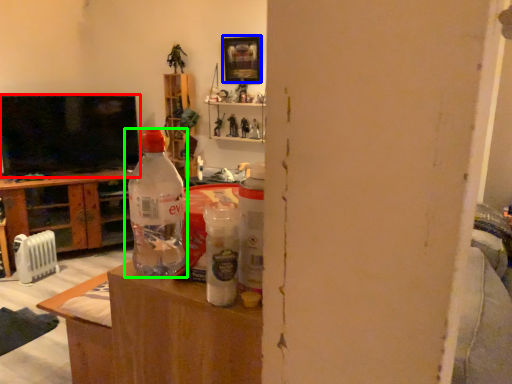
Question: Which is farther away from television (highlighted by a red box)? picture frame (highlighted by a blue box) or bottle (highlighted by a green box)?

Choices:
 (A) picture frame
 (B) bottle

Answer: (B)